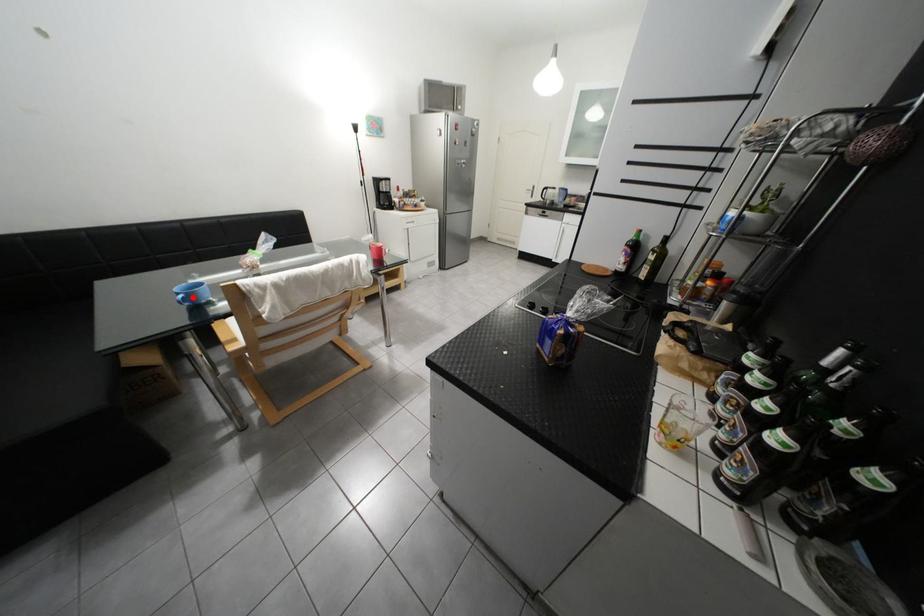
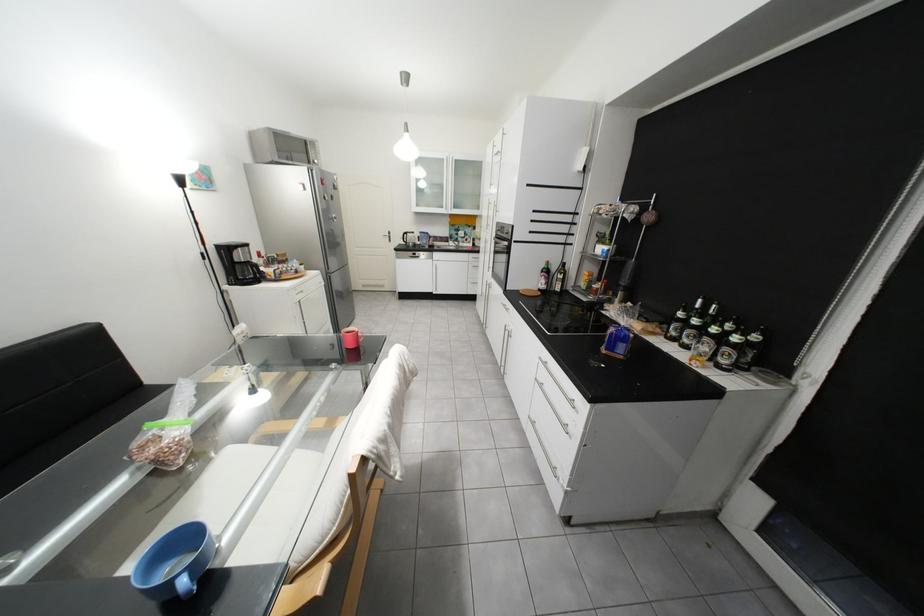
The point at the highlighted location is marked in the first image. Where is the corresponding point in the second image?

(195, 582)